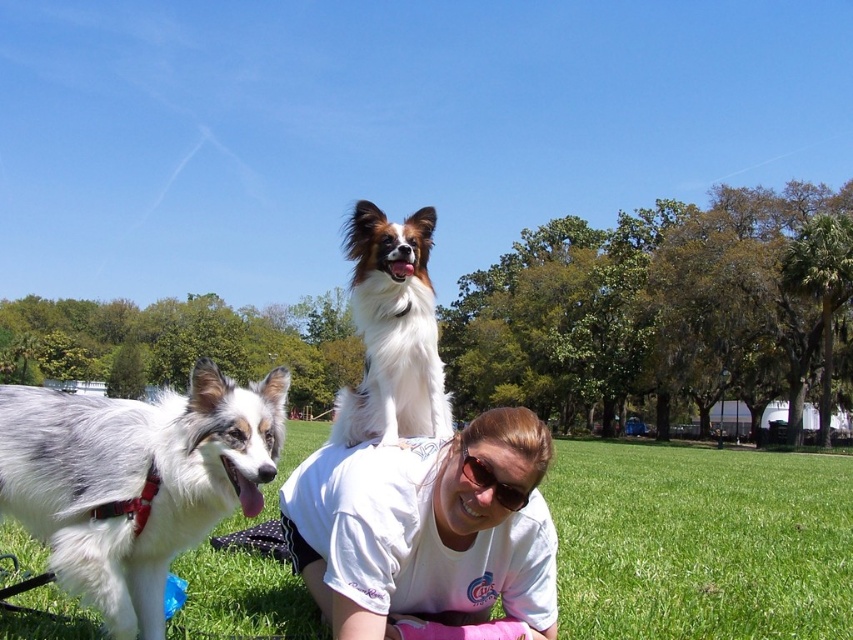
Does green grass at lower center have a greater width compared to sunglasses at center?

Indeed, green grass at lower center has a greater width compared to sunglasses at center.

I want to click on green grass at lower center, so click(700, 541).

Is gray-white fur dog at left shorter than sunglasses at center?

No, gray-white fur dog at left is not shorter than sunglasses at center.

Does point (199, 445) come behind point (474, 472)?

No, it is not.

Identify the location of gray-white fur dog at left. This screenshot has height=640, width=853. (135, 481).

Is green grass at lower center positioned behind gray-white fur dog at left?

That is True.

Does point (732, 579) come behind point (119, 433)?

Yes, it is.

Locate an element on the screen. The image size is (853, 640). green grass at lower center is located at coordinates (700, 541).